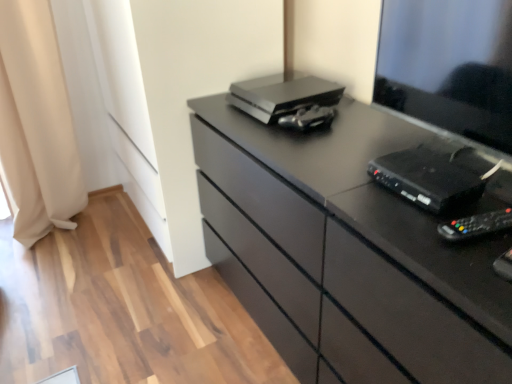
Locate an element on the screen. Image resolution: width=512 pixels, height=384 pixels. free space that is to the left of metallic silver game controller at center, which ranks as the first equipment in back-to-front order is located at coordinates (253, 127).